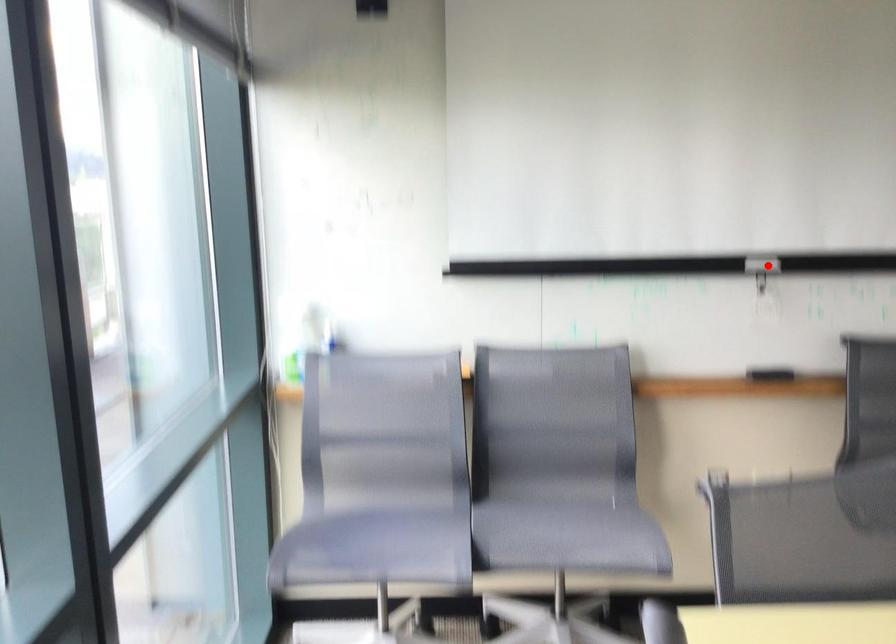
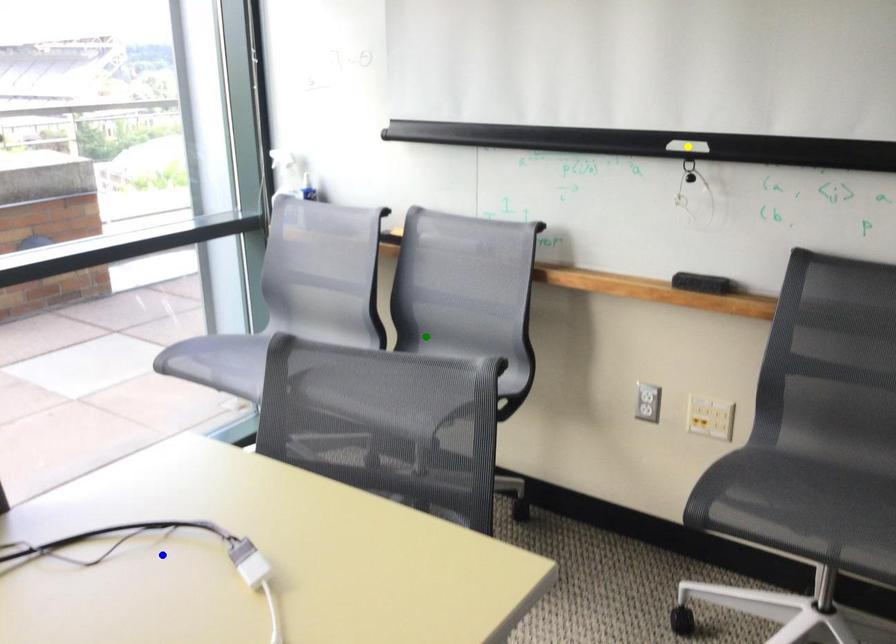
Question: I am providing you with two images of the same scene from different viewpoints. A red point is marked on the first image. You are given multiple points on the second image. Can you choose the point in image 2 that corresponds to the point in image 1?

Choices:
 (A) blue point
 (B) green point
 (C) yellow point

Answer: (C)